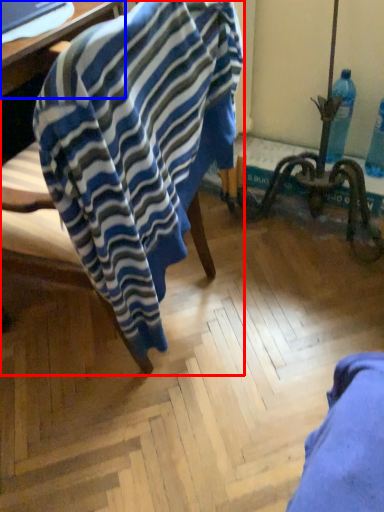
Question: Which object is further to the camera taking this photo, chair (highlighted by a red box) or table (highlighted by a blue box)?

Choices:
 (A) chair
 (B) table

Answer: (B)